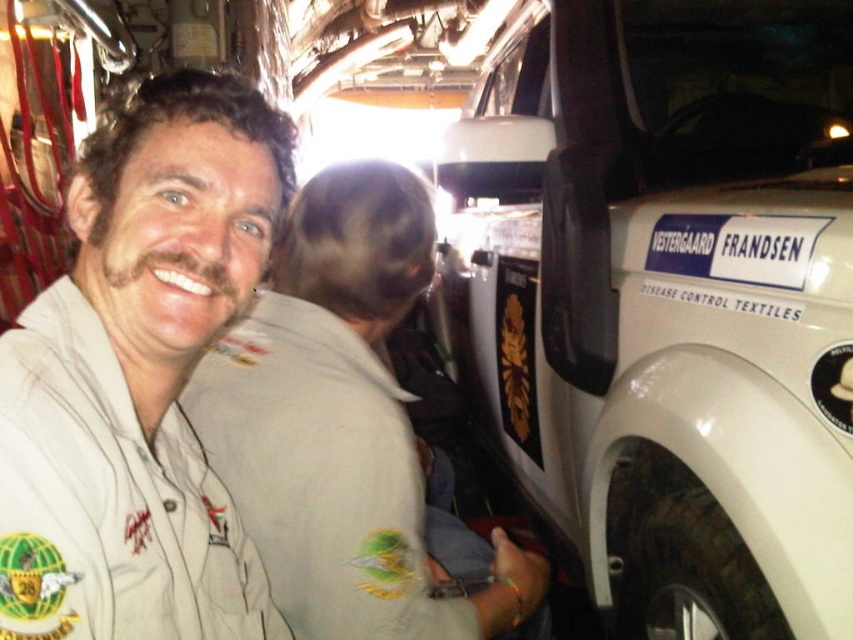
Is point (532, 86) positioned behind point (106, 467)?

Yes, point (532, 86) is farther from viewer.

Is white matte vehicle at right smaller than white matte shirt at upper left?

No, white matte vehicle at right is not smaller than white matte shirt at upper left.

This screenshot has width=853, height=640. Describe the element at coordinates (666, 300) in the screenshot. I see `white matte vehicle at right` at that location.

Where is `white matte vehicle at right`? The height and width of the screenshot is (640, 853). white matte vehicle at right is located at coordinates (666, 300).

Can you confirm if white matte vehicle at right is thinner than light brown uniform at left?

No, white matte vehicle at right is not thinner than light brown uniform at left.

Is point (602, 166) positioned behind point (366, 195)?

Yes, it is.

Who is more distant from viewer, (769,550) or (412,296)?

Point (412,296)

This screenshot has height=640, width=853. In order to click on white matte vehicle at right in this screenshot , I will do `click(666, 300)`.

Is white matte shirt at upper left wider than light brown uniform at left?

In fact, white matte shirt at upper left might be narrower than light brown uniform at left.

Who is more distant from viewer, (155, 115) or (376, 456)?

The point (376, 456) is behind.

Locate an element on the screen. white matte shirt at upper left is located at coordinates (138, 378).